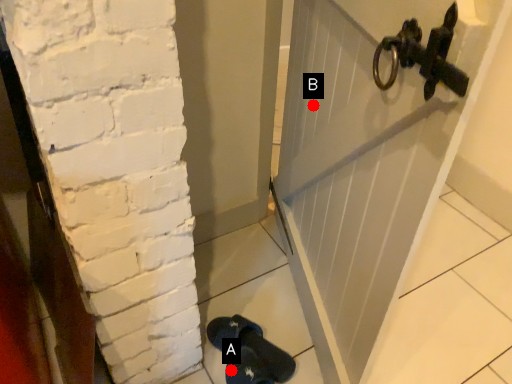
Question: Two points are circled on the image, labeled by A and B beside each circle. Which point is farther to the camera?

Choices:
 (A) A is further
 (B) B is further

Answer: (A)